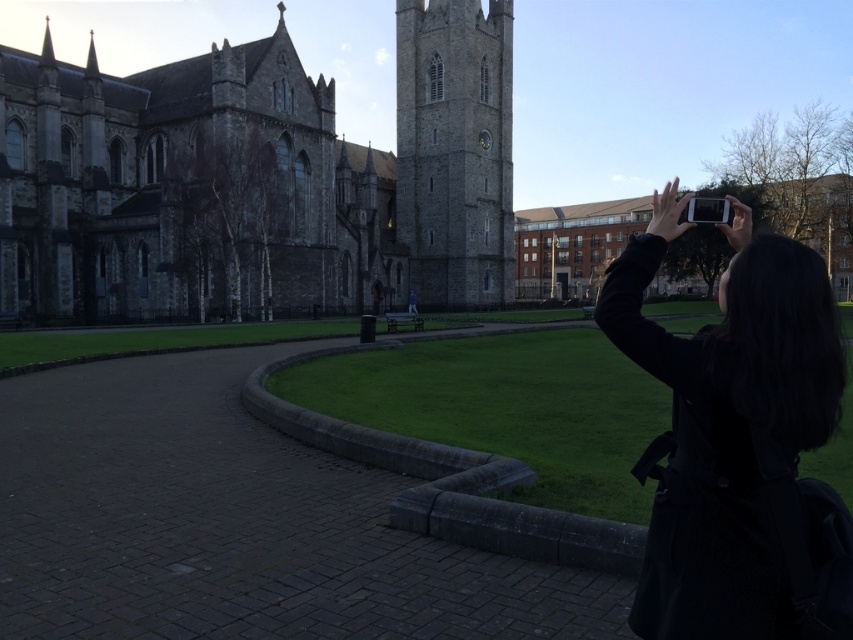
Question: Which point is closer to the camera taking this photo?

Choices:
 (A) (223, 204)
 (B) (444, 10)
 (C) (674, 516)

Answer: (C)

Question: Estimate the real-world distances between objects in this image. Which object is farther from the gray stone church at left?

Choices:
 (A) gray stone tower at center
 (B) black fabric coat at upper right

Answer: (B)

Question: Can you confirm if black fabric coat at upper right is positioned below gray stone tower at center?

Choices:
 (A) no
 (B) yes

Answer: (B)

Question: Can you confirm if black fabric coat at upper right is thinner than gray stone tower at center?

Choices:
 (A) yes
 (B) no

Answer: (A)

Question: Which point is farther to the camera?

Choices:
 (A) black fabric coat at upper right
 (B) gray stone tower at center

Answer: (B)

Question: Does black fabric coat at upper right lie in front of gray stone tower at center?

Choices:
 (A) no
 (B) yes

Answer: (B)